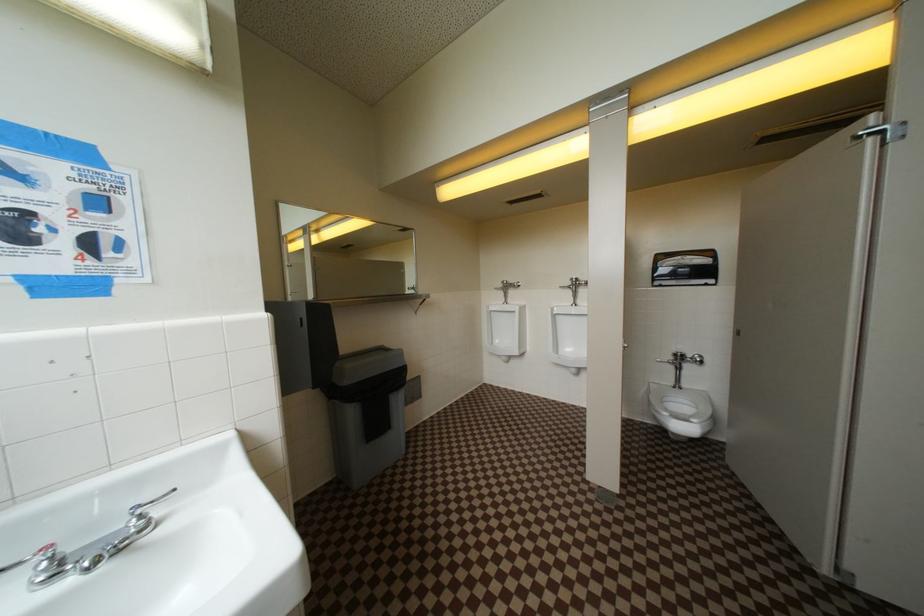
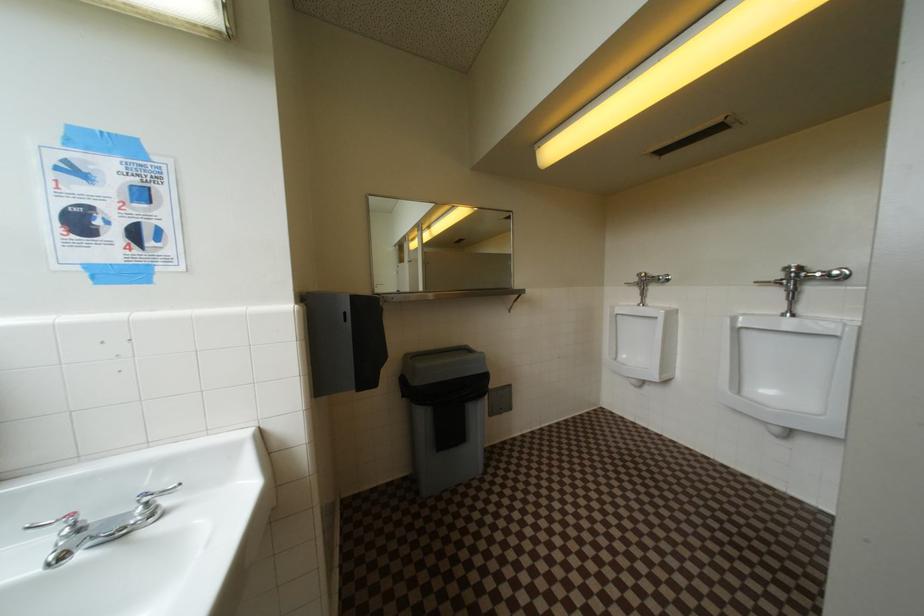
Question: Based on the continuous images, in which direction is the camera rotating? Reply with the corresponding letter.

Choices:
 (A) Left
 (B) Right
 (C) Up
 (D) Down

Answer: (A)